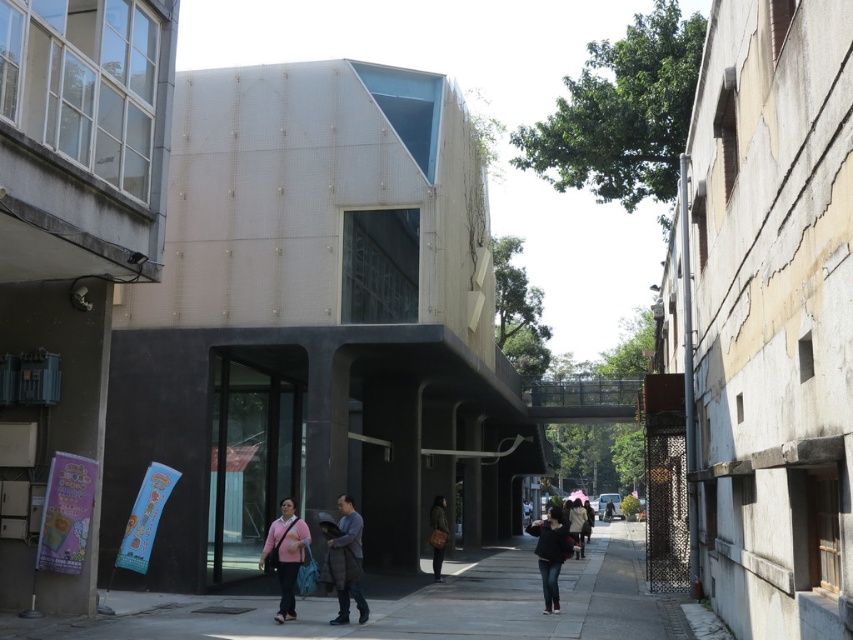
Question: Which point appears closest to the camera in this image?

Choices:
 (A) (277, 525)
 (B) (582, 540)
 (C) (548, 602)

Answer: (A)

Question: Which point is closer to the camera?

Choices:
 (A) (277, 520)
 (B) (439, 561)
 (C) (579, 632)
 (D) (360, 605)

Answer: (C)

Question: Is brown leather bag at center behind pink fabric umbrella at center?

Choices:
 (A) no
 (B) yes

Answer: (B)

Question: Which point is closer to the camera?

Choices:
 (A) (549, 596)
 (B) (334, 540)

Answer: (B)

Question: Can you confirm if black matte jacket at center is wider than pink fabric umbrella at center?

Choices:
 (A) no
 (B) yes

Answer: (B)

Question: Does concrete at center have a larger size compared to brown leather bag at center?

Choices:
 (A) no
 (B) yes

Answer: (B)